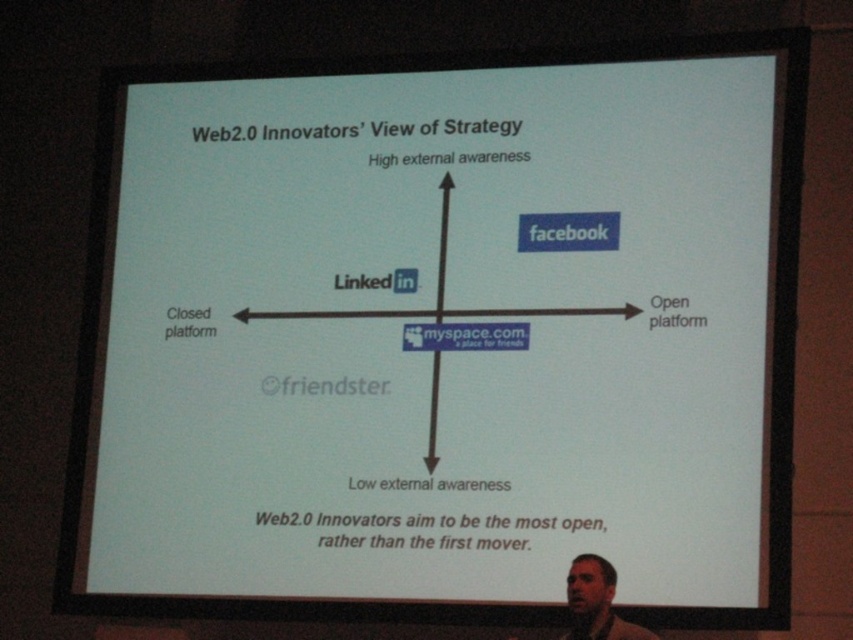
Question: Which point is farther to the camera?

Choices:
 (A) black arrow at center
 (B) light brown skin at lower right

Answer: (A)

Question: Is light brown skin at lower right in front of black arrow at center?

Choices:
 (A) yes
 (B) no

Answer: (A)

Question: Does light brown skin at lower right have a greater width compared to black arrow at center?

Choices:
 (A) yes
 (B) no

Answer: (B)

Question: Observing the image, what is the correct spatial positioning of light brown skin at lower right in reference to black arrow at center?

Choices:
 (A) above
 (B) below

Answer: (B)